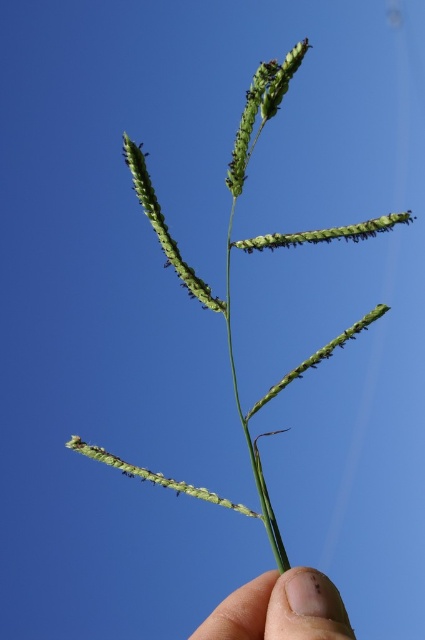
Question: Where is green matte grass at center located in relation to flesh/soft skin at lower center in the image?

Choices:
 (A) below
 (B) above

Answer: (B)

Question: Which point appears closest to the camera in this image?

Choices:
 (A) (317, 582)
 (B) (210, 500)

Answer: (A)

Question: Is green matte grass at center to the left of flesh/soft skin at lower center from the viewer's perspective?

Choices:
 (A) yes
 (B) no

Answer: (A)

Question: Which object appears farthest from the camera in this image?

Choices:
 (A) green matte grass at center
 (B) flesh/soft skin at lower center

Answer: (A)

Question: Does green matte grass at center have a larger size compared to flesh/soft skin at lower center?

Choices:
 (A) no
 (B) yes

Answer: (B)

Question: Which object appears farthest from the camera in this image?

Choices:
 (A) green matte grass at center
 (B) flesh/soft skin at lower center

Answer: (A)